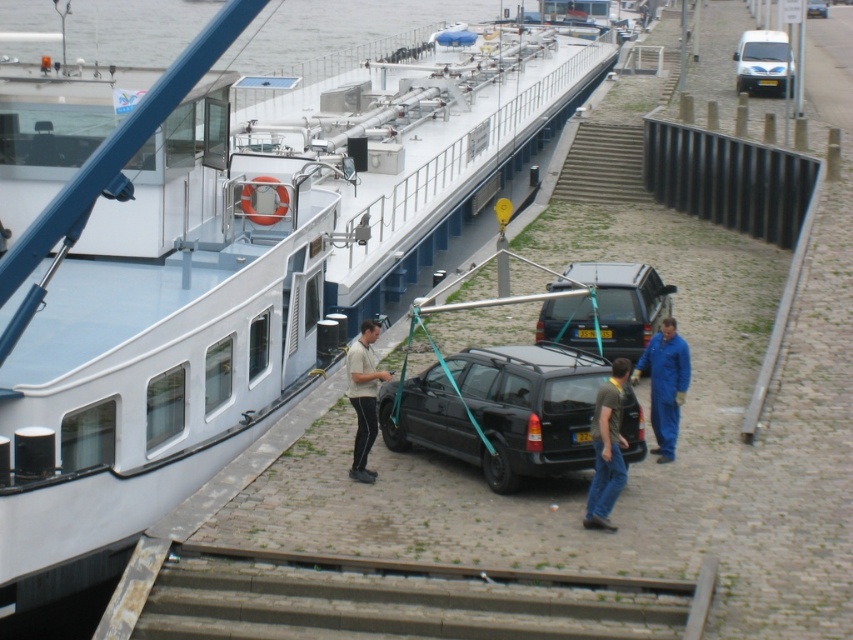
You are a delivery driver who needs to park your matte black suv at center on the barge. The barge has a loading area that is 1.2 meters wide. Can you safely park your vehicle there?

The position of matte black suv at center is at point (622, 301), but the question about the width of the loading area and the vehicle is not directly addressed in the provided Objects Description. Therefore, I cannot determine if it will fit based on the given information.

You are a delivery driver who needs to park your matte black suv at center on the barge. The blue coveralls at lower right is a worker guiding you. What is the minimum distance you should keep between your suv and the worker to ensure safety?

The matte black suv at center is 3.32 meters away from blue coveralls at lower right. To ensure safety, you should maintain at least 3.32 meters distance between your suv and the worker.

You are a delivery driver who needs to unload a package from your white glossy van at upper right. You see a person wearing a white cotton shirt at center nearby. Where should you go to find the person?

The white cotton shirt at center is below the white glossy van at upper right, so you should go below the white glossy van at upper right to find the person wearing the white cotton shirt at center.